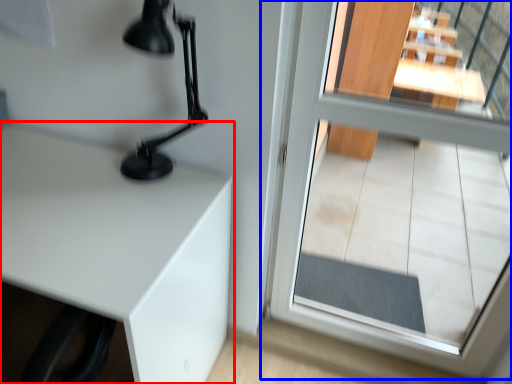
Question: Which point is further to the camera, table (highlighted by a red box) or glass door (highlighted by a blue box)?

Choices:
 (A) table
 (B) glass door

Answer: (A)